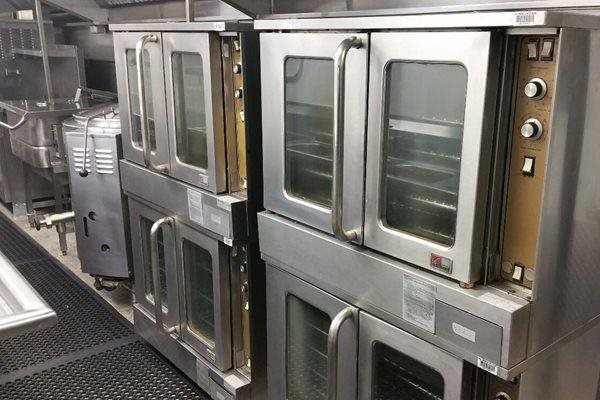
The width and height of the screenshot is (600, 400). I want to click on vent in the upper left of image, so click(x=17, y=39).